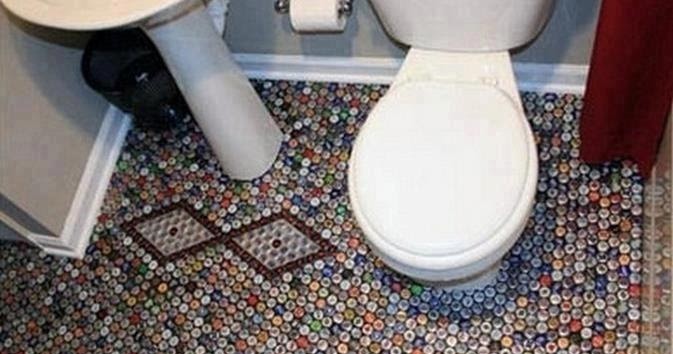
Where is `toilet paper holder`? toilet paper holder is located at coordinates (281, 7).